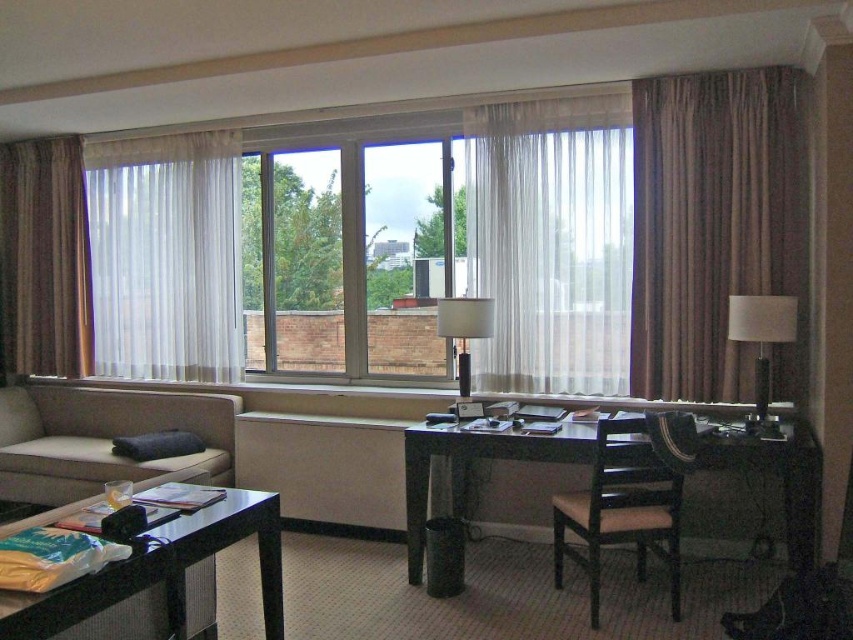
Does dark wood desk at center come behind white glossy table lamp at right?

No, dark wood desk at center is in front of white glossy table lamp at right.

Between dark wood desk at center and white glossy table lamp at right, which one has less height?

white glossy table lamp at right is shorter.

Identify the location of dark wood desk at center. The height and width of the screenshot is (640, 853). 471,468.

Does clear glass window at center have a lesser height compared to white glossy table lamp at right?

Incorrect, clear glass window at center's height does not fall short of white glossy table lamp at right's.

Is point (453, 192) more distant than point (770, 342)?

Yes.

Locate an element on the screen. Image resolution: width=853 pixels, height=640 pixels. clear glass window at center is located at coordinates (357, 260).

Is brown textured curtain at left closer to camera compared to black glass table at lower left?

No, it is behind black glass table at lower left.

Is point (35, 237) positioned in front of point (175, 561)?

No, it is behind (175, 561).

Measure the distance between point (51, 259) and camera.

They are 16.85 feet apart.

The image size is (853, 640). I want to click on brown textured curtain at left, so click(44, 257).